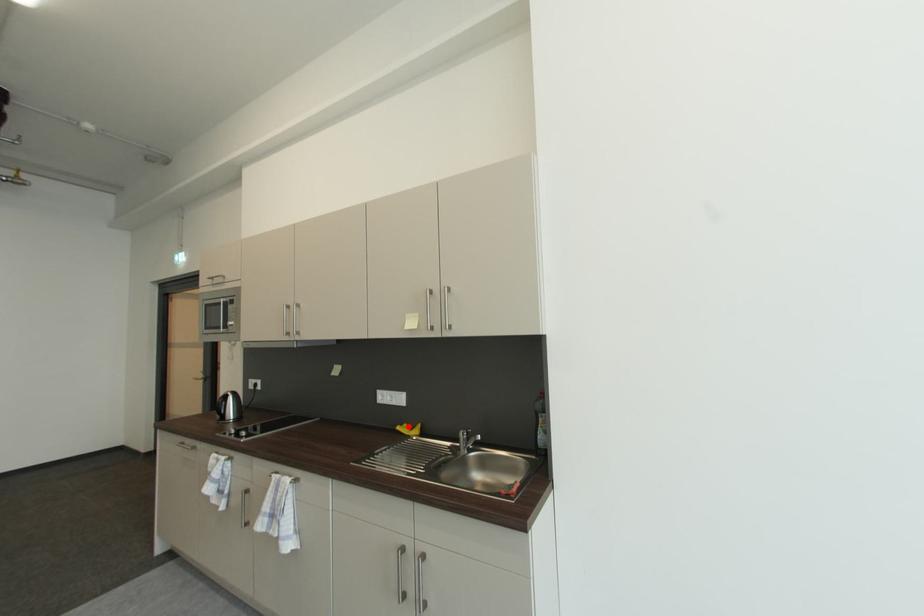
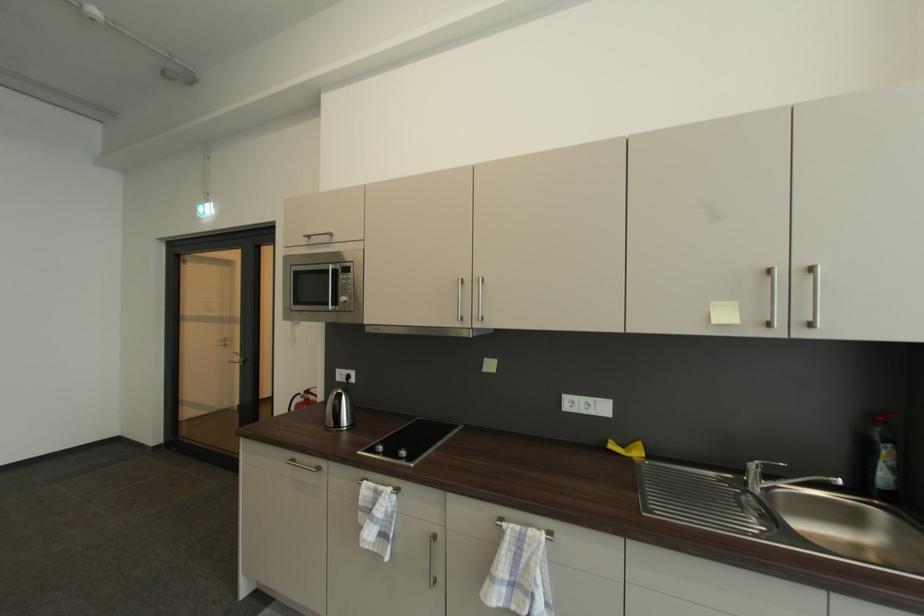
Find the pixel in the second image that matches the highlighted location in the first image.

(613, 443)